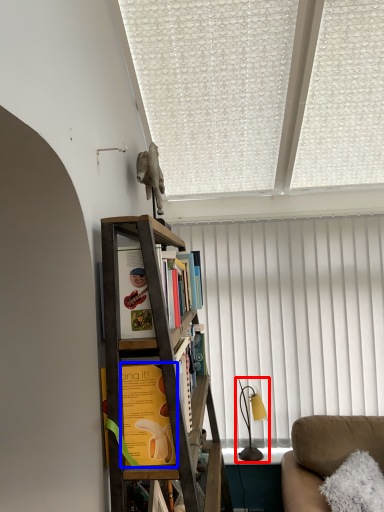
Question: Which of the following is the closest to the observer, table lamp (highlighted by a red box) or book (highlighted by a blue box)?

Choices:
 (A) table lamp
 (B) book

Answer: (B)